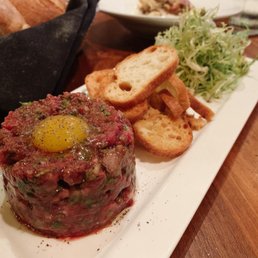
Where is `front white porcelain plate`? front white porcelain plate is located at coordinates (245, 96), (170, 227).